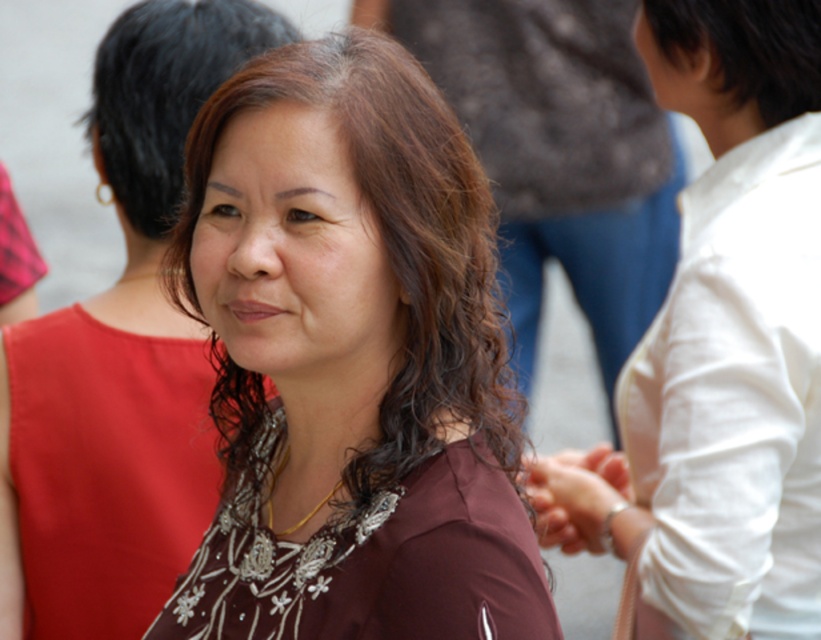
Who is positioned more to the right, satin red dress at center or beaded fabric dress at center?

beaded fabric dress at center is more to the right.

Is satin red dress at center to the left of beaded fabric dress at center from the viewer's perspective?

Correct, you'll find satin red dress at center to the left of beaded fabric dress at center.

Locate an element on the screen. The width and height of the screenshot is (821, 640). satin red dress at center is located at coordinates (106, 468).

Where is `satin red dress at center`? Image resolution: width=821 pixels, height=640 pixels. satin red dress at center is located at coordinates (106, 468).

Is point (413, 250) farther from viewer compared to point (549, 602)?

Yes, point (413, 250) is behind point (549, 602).

Who is lower down, brown wavy hair at center or beaded fabric dress at center?

Positioned lower is beaded fabric dress at center.

Locate an element on the screen. This screenshot has width=821, height=640. brown wavy hair at center is located at coordinates (390, 236).

Identify the location of brown wavy hair at center. (390, 236).

How distant is matte brown hair at center from dark brown hair at upper right?

The distance of matte brown hair at center from dark brown hair at upper right is 34.87 inches.

Which is in front, point (196, 339) or point (803, 109)?

Positioned in front is point (803, 109).

The image size is (821, 640). What are the coordinates of `matte brown hair at center` in the screenshot? It's located at (120, 355).